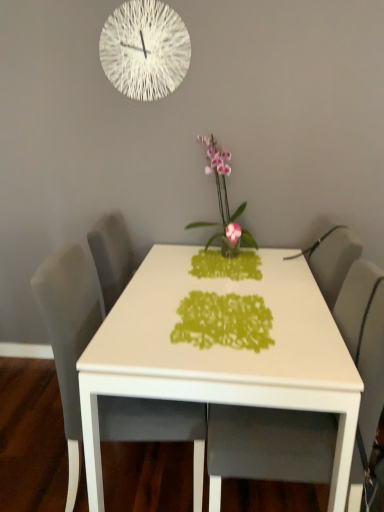
The height and width of the screenshot is (512, 384). I want to click on free location to the left of gray fabric chair at left, which is the first chair from left to right, so click(x=35, y=454).